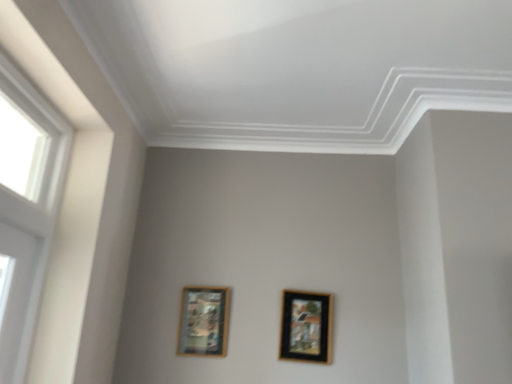
Question: Does wooden framed artwork at lower left, positioned as the 2th picture frame in right-to-left order, appear on the left side of white plastic window at left?

Choices:
 (A) yes
 (B) no

Answer: (B)

Question: Is wooden framed artwork at lower left, positioned as the 2th picture frame in right-to-left order, to the right of white plastic window at left from the viewer's perspective?

Choices:
 (A) yes
 (B) no

Answer: (A)

Question: Considering the relative sizes of wooden framed artwork at lower left, positioned as the 2th picture frame in right-to-left order, and white plastic window at left in the image provided, is wooden framed artwork at lower left, positioned as the 2th picture frame in right-to-left order, bigger than white plastic window at left?

Choices:
 (A) yes
 (B) no

Answer: (B)

Question: From the image's perspective, is wooden framed artwork at lower left, positioned as the 2th picture frame in right-to-left order, below white plastic window at left?

Choices:
 (A) yes
 (B) no

Answer: (A)

Question: Considering the relative sizes of wooden framed artwork at lower left, positioned as the 2th picture frame in right-to-left order, and white plastic window at left in the image provided, is wooden framed artwork at lower left, positioned as the 2th picture frame in right-to-left order, smaller than white plastic window at left?

Choices:
 (A) yes
 (B) no

Answer: (A)

Question: Considering the relative sizes of wooden framed artwork at lower left, positioned as the 2th picture frame in right-to-left order, and white plastic window at left in the image provided, is wooden framed artwork at lower left, positioned as the 2th picture frame in right-to-left order, thinner than white plastic window at left?

Choices:
 (A) yes
 (B) no

Answer: (A)

Question: Does black glossy picture frame at center, which appears as the second picture frame when viewed from the left, turn towards wooden framed artwork at lower left, positioned as the 2th picture frame in right-to-left order?

Choices:
 (A) no
 (B) yes

Answer: (A)

Question: From the image's perspective, is black glossy picture frame at center, which appears as the second picture frame when viewed from the left, on top of wooden framed artwork at lower left, which is counted as the 1th picture frame, starting from the left?

Choices:
 (A) no
 (B) yes

Answer: (A)

Question: Can you confirm if black glossy picture frame at center, which appears as the second picture frame when viewed from the left, is smaller than wooden framed artwork at lower left, which is counted as the 1th picture frame, starting from the left?

Choices:
 (A) yes
 (B) no

Answer: (B)

Question: Considering the relative positions of black glossy picture frame at center, which appears as the second picture frame when viewed from the left, and wooden framed artwork at lower left, positioned as the 2th picture frame in right-to-left order, in the image provided, is black glossy picture frame at center, which appears as the second picture frame when viewed from the left, to the left of wooden framed artwork at lower left, positioned as the 2th picture frame in right-to-left order, from the viewer's perspective?

Choices:
 (A) no
 (B) yes

Answer: (A)

Question: From a real-world perspective, is black glossy picture frame at center, which appears as the second picture frame when viewed from the left, below wooden framed artwork at lower left, positioned as the 2th picture frame in right-to-left order?

Choices:
 (A) no
 (B) yes

Answer: (A)

Question: Does black glossy picture frame at center, which appears as the second picture frame when viewed from the left, have a greater height compared to wooden framed artwork at lower left, positioned as the 2th picture frame in right-to-left order?

Choices:
 (A) no
 (B) yes

Answer: (B)

Question: Can you confirm if black glossy picture frame at center, marked as the 1th picture frame in a right-to-left arrangement, is bigger than white plastic window at left?

Choices:
 (A) yes
 (B) no

Answer: (B)